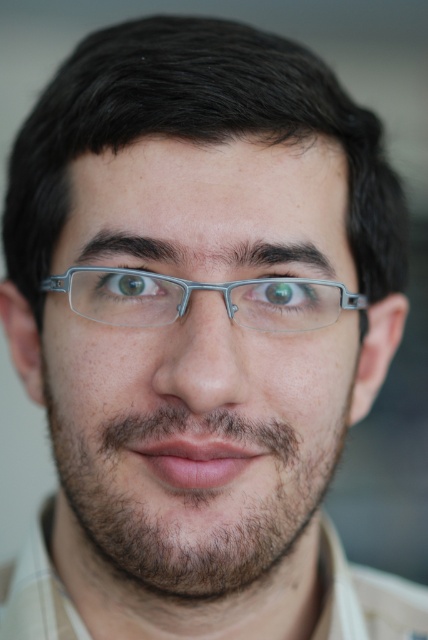
You are taking a photo and want to ensure that both the point at point (261,221) and the point at point (103,291) are in focus. Based on the image, which point should you focus on first to maximize the chances of both being sharp?

You should focus on point (261,221) first because it is closer to the camera, so focusing there will ensure that the farther point (103,291) is within the depth of field.

You are a photographer adjusting the focus of your camera. You want to ensure the green matte eye at center is in sharp focus. Where should you adjust the focus point to?

The green matte eye at center is located at point (284, 298), so you should adjust the focus point to that coordinate to ensure it is in sharp focus.

Based on the scene description, which object is taller between the clear plastic glasses at center and the green matte eye at center?

The clear plastic glasses at center is much taller than the green matte eye at center.